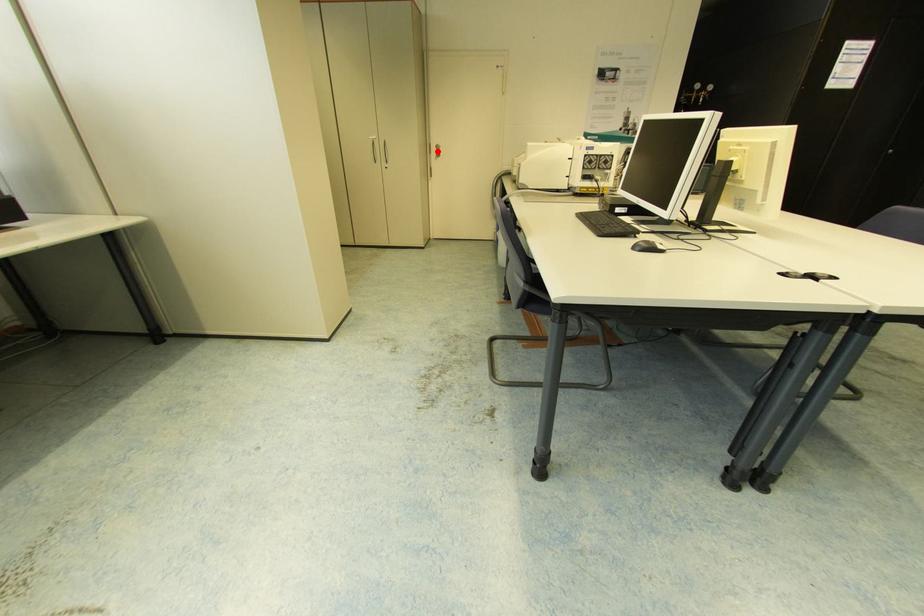
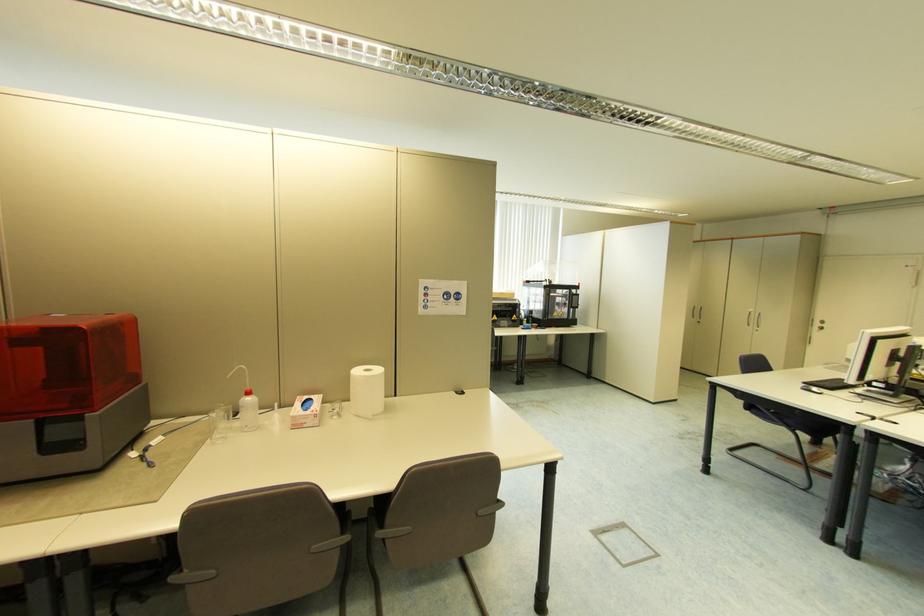
In the second image, find the point that corresponds to the highlighted location in the first image.

(821, 325)